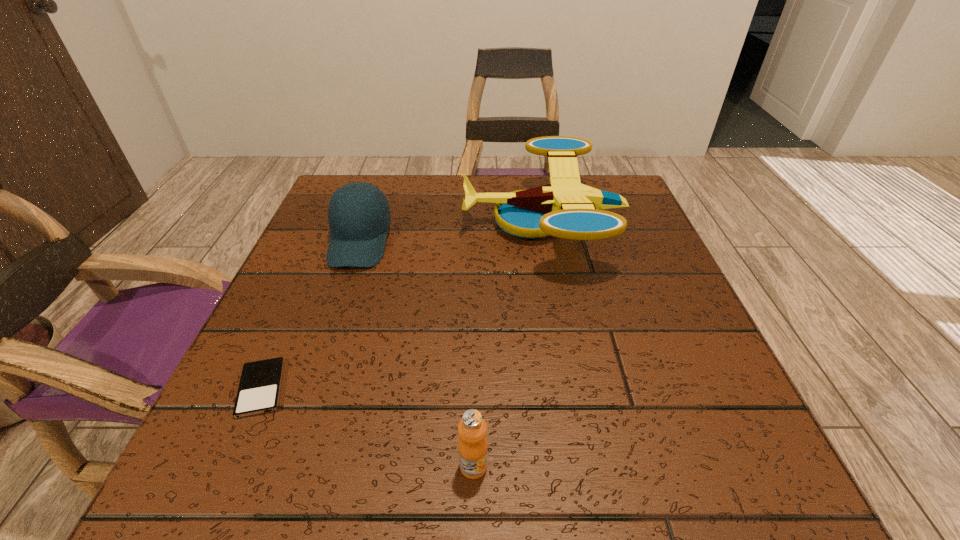
I want to click on vacant region at the right edge of the desktop, so (640, 289).

I want to click on free spot at the far left corner of the desktop, so click(388, 174).

The width and height of the screenshot is (960, 540). I want to click on free space at the near left corner of the desktop, so click(x=253, y=498).

Find the location of a particular element. vacant space at the far right corner is located at coordinates (603, 180).

In the image, there is a desktop. Where is `vacant region at the near right corner`? vacant region at the near right corner is located at coordinates (738, 449).

You are a GUI agent. You are given a task and a screenshot of the screen. Output one action in this format:
    pyautogui.click(x=<x>, y=<y>)
    Task: Click on the vacant space in between the baseball cap and the drone
    
    Given the screenshot: What is the action you would take?
    pyautogui.click(x=451, y=232)

Where is `empty space between the baseball cap and the orange juice`? empty space between the baseball cap and the orange juice is located at coordinates (417, 354).

Find the location of a particular element. Image resolution: width=960 pixels, height=540 pixels. free space between the baseball cap and the nearest object is located at coordinates (417, 354).

I want to click on vacant area that lies between the shortest object and the baseball cap, so click(x=311, y=315).

You are a GUI agent. You are given a task and a screenshot of the screen. Output one action in this format:
    pyautogui.click(x=<x>, y=<y>)
    Task: Click on the free space between the drone and the shortest object
    The width and height of the screenshot is (960, 540).
    Given the screenshot: What is the action you would take?
    pyautogui.click(x=402, y=305)